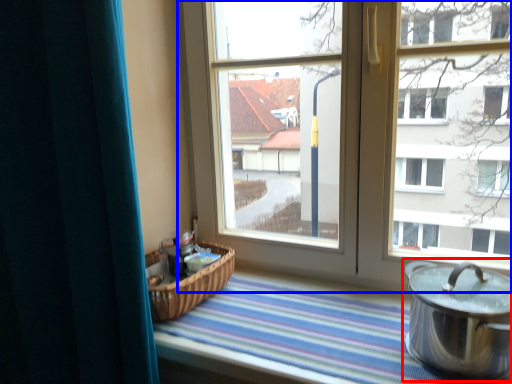
Question: Which object appears closest to the camera in this image, crock pot (highlighted by a red box) or window (highlighted by a blue box)?

Choices:
 (A) crock pot
 (B) window

Answer: (A)